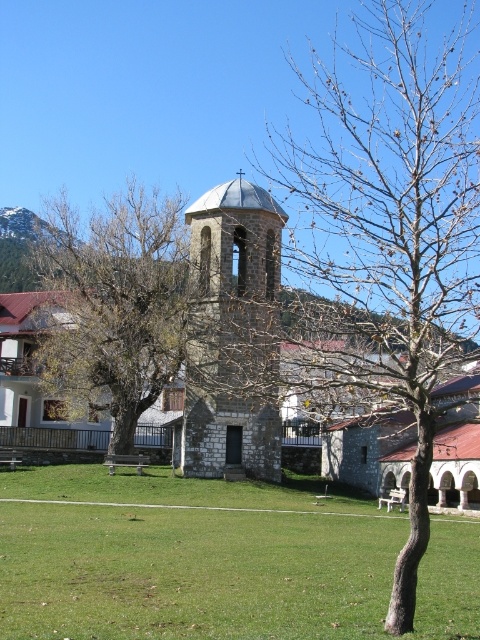
Can you confirm if bare branches at center is taller than stone bell tower at center?

Yes.

Is bare branches at center wider than stone bell tower at center?

Correct, the width of bare branches at center exceeds that of stone bell tower at center.

The image size is (480, 640). I want to click on bare branches at center, so click(x=396, y=221).

Who is positioned more to the left, green grass at center or bare branches at center?

From the viewer's perspective, green grass at center appears more on the left side.

Is green grass at center positioned in front of bare branches at center?

Yes.

Is point (180, 621) farther from viewer compared to point (407, 227)?

Yes.

Where is `green grass at center`? The width and height of the screenshot is (480, 640). green grass at center is located at coordinates (216, 561).

Which is more to the left, green grass at center or stone bell tower at center?

green grass at center is more to the left.

Which is more to the right, green grass at center or stone bell tower at center?

From the viewer's perspective, stone bell tower at center appears more on the right side.

Is point (36, 621) behind point (207, 365)?

No.

Locate an element on the screen. This screenshot has width=480, height=640. green grass at center is located at coordinates (216, 561).